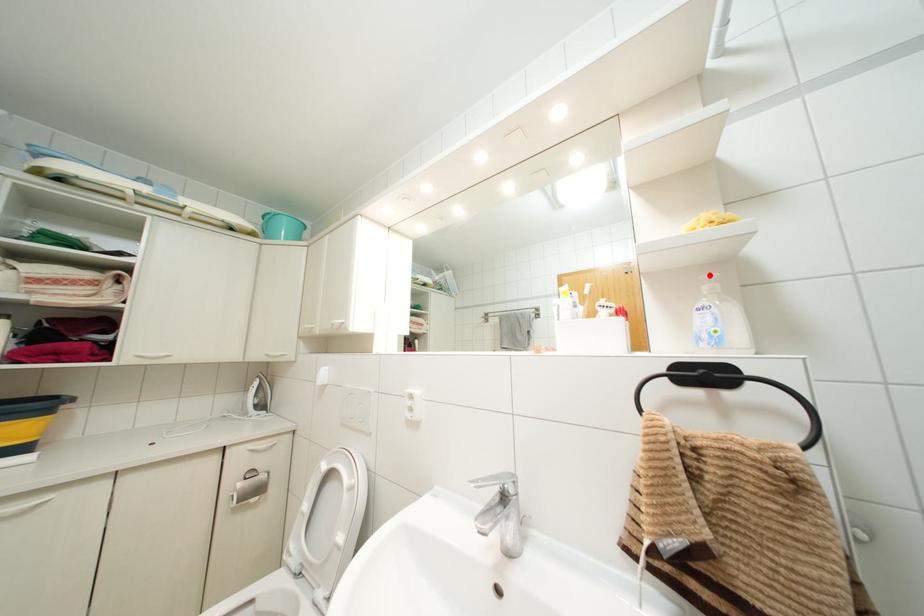
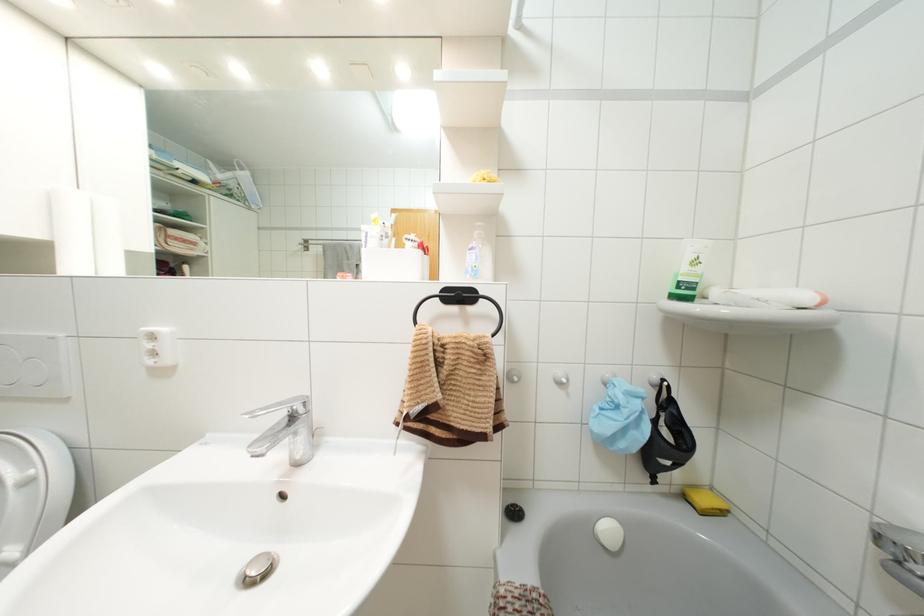
In the second image, find the point that corresponds to the highlighted location in the first image.

(479, 223)